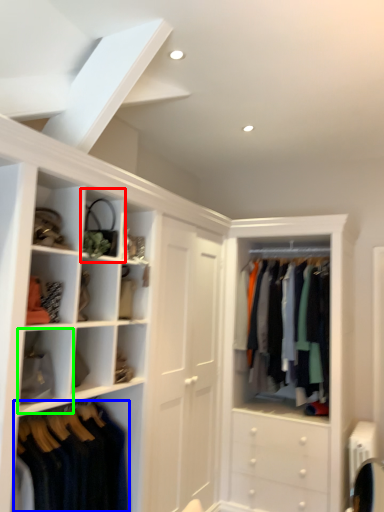
Question: Which object is positioned farthest from cabinet (highlighted by a red box)? Select from clothing (highlighted by a blue box) and cabinet (highlighted by a green box).

Choices:
 (A) clothing
 (B) cabinet

Answer: (A)